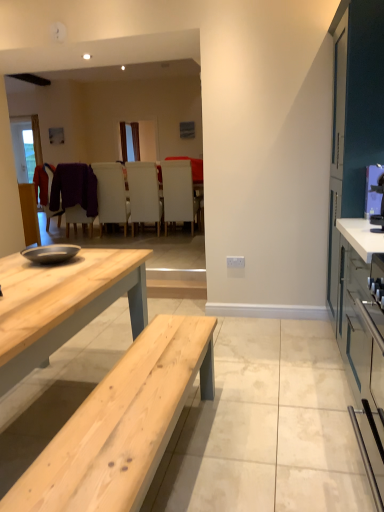
Image resolution: width=384 pixels, height=512 pixels. Identify the location of natural wood table at center. (122, 424).

At what (x,y) coordinates should I click in order to perform the action: click on purple fuzzy sweater at center. Please return your answer as a coordinate pair (x, y). Looking at the image, I should click on (74, 188).

Describe the element at coordinates (144, 194) in the screenshot. This screenshot has width=384, height=512. I see `white matte chair at center, arranged as the 2th chair when viewed from the right` at that location.

The width and height of the screenshot is (384, 512). What do you see at coordinates (375, 195) in the screenshot?
I see `metallic blue microwave at right` at bounding box center [375, 195].

Describe the element at coordinates (178, 192) in the screenshot. I see `white matte chair at center, which is the first chair in right-to-left order` at that location.

Measure the distance between point (362, 346) and camera.

2.02 meters.

Where is `matte black chair at center, the 1th chair in the left-to-right sequence`? matte black chair at center, the 1th chair in the left-to-right sequence is located at coordinates (46, 191).

Where is `white leather chair at center, positioned as the third chair in right-to-left order`? white leather chair at center, positioned as the third chair in right-to-left order is located at coordinates (111, 195).

Which object is positioned more to the left, matte black chair at center, which appears as the 4th chair when viewed from the right, or white matte chair at center, arranged as the 2th chair when viewed from the right?

Positioned to the left is matte black chair at center, which appears as the 4th chair when viewed from the right.

Based on the photo, is matte black chair at center, which appears as the 4th chair when viewed from the right, with white matte chair at center, placed as the 3th chair when sorted from left to right?

matte black chair at center, which appears as the 4th chair when viewed from the right, and white matte chair at center, placed as the 3th chair when sorted from left to right, are clearly separated.

Considering the sizes of objects matte black chair at center, the 1th chair in the left-to-right sequence, and white matte chair at center, arranged as the 2th chair when viewed from the right, in the image provided, who is smaller, matte black chair at center, the 1th chair in the left-to-right sequence, or white matte chair at center, arranged as the 2th chair when viewed from the right,?

matte black chair at center, the 1th chair in the left-to-right sequence, is smaller.

Which object is closer to the camera taking this photo, purple fuzzy sweater at center or white matte chair at center, arranged as the 2th chair when viewed from the right?

purple fuzzy sweater at center.

Is purple fuzzy sweater at center shorter than white matte chair at center, arranged as the 2th chair when viewed from the right?

Yes.

Is purple fuzzy sweater at center bigger than white matte chair at center, arranged as the 2th chair when viewed from the right?

Yes, purple fuzzy sweater at center is bigger than white matte chair at center, arranged as the 2th chair when viewed from the right.

How different are the orientations of natural wood table at center and purple fuzzy sweater at center in degrees?

178 degrees separate the facing orientations of natural wood table at center and purple fuzzy sweater at center.

Is natural wood table at center at the left side of purple fuzzy sweater at center?

Incorrect, natural wood table at center is not on the left side of purple fuzzy sweater at center.

Is natural wood table at center spatially inside purple fuzzy sweater at center, or outside of it?

natural wood table at center is not enclosed by purple fuzzy sweater at center.

Is natural wood table at center smaller than purple fuzzy sweater at center?

No.

Consider the image. Which object is more forward, natural wood table at center or white matte chair at center, which is the first chair in right-to-left order?

natural wood table at center.

Who is shorter, natural wood table at center or white matte chair at center, the 4th chair from the left?

Standing shorter between the two is natural wood table at center.

From the image's perspective, is natural wood table at center positioned above or below white matte chair at center, the 4th chair from the left?

natural wood table at center is situated lower than white matte chair at center, the 4th chair from the left, in the image.

Are natural wood table at center and white matte chair at center, which is the first chair in right-to-left order, making contact?

No, natural wood table at center is not making contact with white matte chair at center, which is the first chair in right-to-left order.

Do you think metallic blue microwave at right is within white matte chair at center, placed as the 3th chair when sorted from left to right, or outside of it?

metallic blue microwave at right cannot be found inside white matte chair at center, placed as the 3th chair when sorted from left to right.

Where is `appliance that appears above the white matte chair at center, placed as the 3th chair when sorted from left to right (from a real-world perspective)`? The height and width of the screenshot is (512, 384). appliance that appears above the white matte chair at center, placed as the 3th chair when sorted from left to right (from a real-world perspective) is located at coordinates (375, 195).

Is metallic blue microwave at right placed right next to white matte chair at center, arranged as the 2th chair when viewed from the right?

There is a gap between metallic blue microwave at right and white matte chair at center, arranged as the 2th chair when viewed from the right.

Is the depth of metallic blue microwave at right greater than that of white matte chair at center, arranged as the 2th chair when viewed from the right?

No, metallic blue microwave at right is in front of white matte chair at center, arranged as the 2th chair when viewed from the right.

Is point (193, 224) positioned before point (343, 361)?

No, it is not.

Is white matte chair at center, the 4th chair from the left, inside or outside of matte gray cabinet at right?

white matte chair at center, the 4th chair from the left, exists outside the volume of matte gray cabinet at right.

Based on the photo, which of these two, white matte chair at center, the 4th chair from the left, or matte gray cabinet at right, is thinner?

Thinner between the two is matte gray cabinet at right.

Based on the photo, does white matte chair at center, arranged as the 2th chair when viewed from the right, touch white leather chair at center, positioned as the third chair in right-to-left order?

No, white matte chair at center, arranged as the 2th chair when viewed from the right, is not with white leather chair at center, positioned as the third chair in right-to-left order.

Does point (127, 163) come farther from viewer compared to point (104, 191)?

That is True.

Between white matte chair at center, placed as the 3th chair when sorted from left to right, and white leather chair at center, the second chair when ordered from left to right, which one has larger size?

With larger size is white leather chair at center, the second chair when ordered from left to right.

How many degrees apart are the facing directions of white matte chair at center, arranged as the 2th chair when viewed from the right, and white leather chair at center, the second chair when ordered from left to right?

white matte chair at center, arranged as the 2th chair when viewed from the right, and white leather chair at center, the second chair when ordered from left to right, are facing 0.663 degrees away from each other.

I want to click on chair above the white matte chair at center, placed as the 3th chair when sorted from left to right (from a real-world perspective), so click(x=46, y=191).

Where is `the 1st chair positioned below the purple fuzzy sweater at center (from the image's perspective)`? This screenshot has height=512, width=384. the 1st chair positioned below the purple fuzzy sweater at center (from the image's perspective) is located at coordinates (144, 194).

Consider the image. When comparing their distances from matte gray cabinet at right, does white matte chair at center, arranged as the 2th chair when viewed from the right, or metallic blue microwave at right seem further?

Among the two, white matte chair at center, arranged as the 2th chair when viewed from the right, is located further to matte gray cabinet at right.

From the image, which object appears to be nearer to white matte chair at center, placed as the 3th chair when sorted from left to right, metallic blue microwave at right or white matte chair at center, which is the first chair in right-to-left order?

white matte chair at center, which is the first chair in right-to-left order.

Looking at the image, which one is located further to metallic blue microwave at right, white matte chair at center, the 4th chair from the left, or white leather chair at center, positioned as the third chair in right-to-left order?

white leather chair at center, positioned as the third chair in right-to-left order, is further to metallic blue microwave at right.

Looking at this image, from the image, which object appears to be nearer to white matte chair at center, arranged as the 2th chair when viewed from the right, matte gray cabinet at right or white leather chair at center, positioned as the third chair in right-to-left order?

The object closer to white matte chair at center, arranged as the 2th chair when viewed from the right, is white leather chair at center, positioned as the third chair in right-to-left order.

In the scene shown: Considering their positions, is white matte chair at center, arranged as the 2th chair when viewed from the right, positioned closer to white matte chair at center, which is the first chair in right-to-left order, than metallic blue microwave at right?

white matte chair at center, arranged as the 2th chair when viewed from the right, lies closer to white matte chair at center, which is the first chair in right-to-left order, than the other object.

From the image, which object appears to be nearer to purple fuzzy sweater at center, white matte chair at center, the 4th chair from the left, or metallic blue microwave at right?

white matte chair at center, the 4th chair from the left, lies closer to purple fuzzy sweater at center than the other object.

Which object lies nearer to the anchor point natural wood table at center, white matte chair at center, which is the first chair in right-to-left order, or purple fuzzy sweater at center?

white matte chair at center, which is the first chair in right-to-left order, is closer to natural wood table at center.

Looking at the image, which one is located closer to white leather chair at center, the second chair when ordered from left to right, metallic blue microwave at right or natural wood table at center?

metallic blue microwave at right is closer to white leather chair at center, the second chair when ordered from left to right.

In order to click on appliance positioned between matte gray cabinet at right and white leather chair at center, the second chair when ordered from left to right, from near to far in this screenshot , I will do `click(375, 195)`.

Locate an element on the screen. cabinetry located between natural wood table at center and matte black chair at center, which appears as the 4th chair when viewed from the right, in the depth direction is located at coordinates (363, 340).

Identify the location of laundry positioned between metallic blue microwave at right and matte black chair at center, the 1th chair in the left-to-right sequence, from near to far. (74, 188).

Image resolution: width=384 pixels, height=512 pixels. Identify the location of appliance positioned between natural wood table at center and matte black chair at center, the 1th chair in the left-to-right sequence, from near to far. (375, 195).